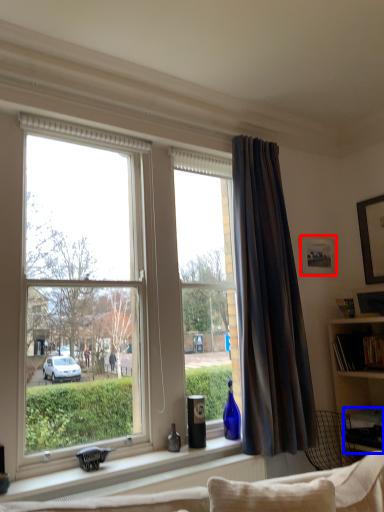
Question: Which object is further to the camera taking this photo, picture frame (highlighted by a red box) or desk (highlighted by a blue box)?

Choices:
 (A) picture frame
 (B) desk

Answer: (A)